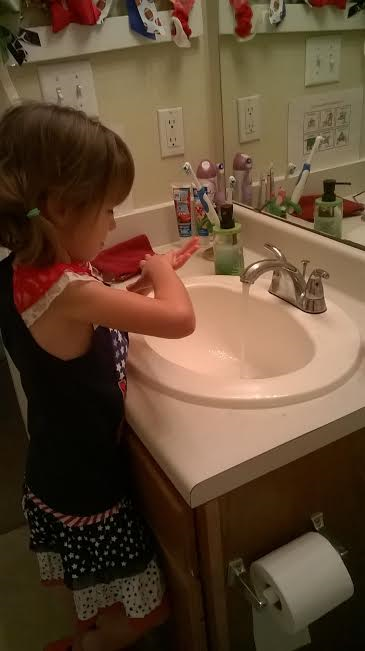
Where is `drawer`? drawer is located at coordinates pos(175,512).